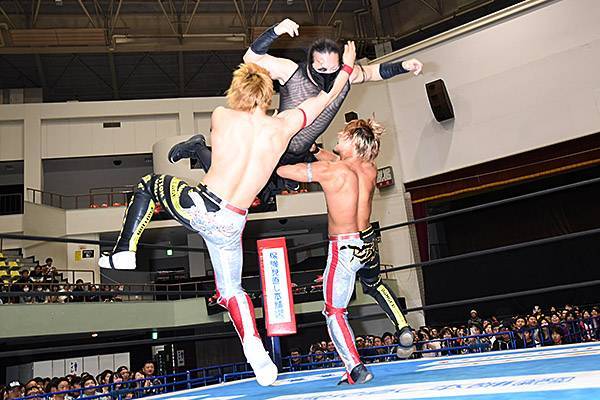
Where is `clock`? The height and width of the screenshot is (400, 600). clock is located at coordinates (385, 175).